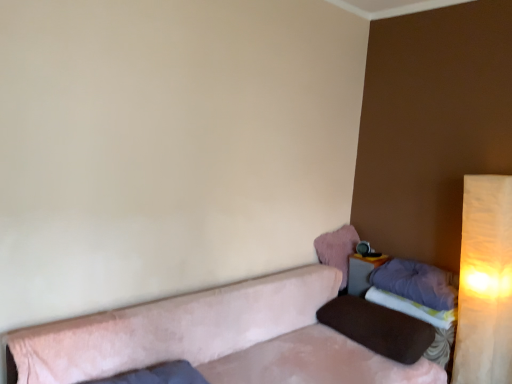
Question: Considering the relative sizes of pink fluffy pillow at upper right, which is the first pillow in top-to-bottom order, and warm beige fabric lampshade at right in the image provided, is pink fluffy pillow at upper right, which is the first pillow in top-to-bottom order, taller than warm beige fabric lampshade at right?

Choices:
 (A) yes
 (B) no

Answer: (B)

Question: Considering the relative positions of pink fluffy pillow at upper right, arranged as the third pillow when ordered from the bottom, and warm beige fabric lampshade at right in the image provided, is pink fluffy pillow at upper right, arranged as the third pillow when ordered from the bottom, to the left of warm beige fabric lampshade at right from the viewer's perspective?

Choices:
 (A) no
 (B) yes

Answer: (B)

Question: Is pink fluffy pillow at upper right, arranged as the third pillow when ordered from the bottom, thinner than warm beige fabric lampshade at right?

Choices:
 (A) yes
 (B) no

Answer: (B)

Question: Is warm beige fabric lampshade at right at the back of pink fluffy pillow at upper right, arranged as the third pillow when ordered from the bottom?

Choices:
 (A) yes
 (B) no

Answer: (B)

Question: Is pink fluffy pillow at upper right, which is the first pillow in top-to-bottom order, shorter than warm beige fabric lampshade at right?

Choices:
 (A) no
 (B) yes

Answer: (B)

Question: From the image's perspective, is pink fluffy pillow at upper right, arranged as the third pillow when ordered from the bottom, on top of warm beige fabric lampshade at right?

Choices:
 (A) yes
 (B) no

Answer: (A)

Question: Is suede-like beige couch at lower right further to camera compared to matte gray table at lower right?

Choices:
 (A) yes
 (B) no

Answer: (B)

Question: Does suede-like beige couch at lower right come in front of matte gray table at lower right?

Choices:
 (A) no
 (B) yes

Answer: (B)

Question: Is suede-like beige couch at lower right aimed at matte gray table at lower right?

Choices:
 (A) no
 (B) yes

Answer: (A)

Question: Does suede-like beige couch at lower right have a lesser height compared to matte gray table at lower right?

Choices:
 (A) no
 (B) yes

Answer: (A)

Question: Does suede-like beige couch at lower right have a lesser width compared to matte gray table at lower right?

Choices:
 (A) yes
 (B) no

Answer: (B)

Question: Can you confirm if suede-like beige couch at lower right is wider than matte gray table at lower right?

Choices:
 (A) no
 (B) yes

Answer: (B)

Question: Is purple soft pillow at right, the 2th pillow from the top, far away from warm beige fabric lampshade at right?

Choices:
 (A) yes
 (B) no

Answer: (B)